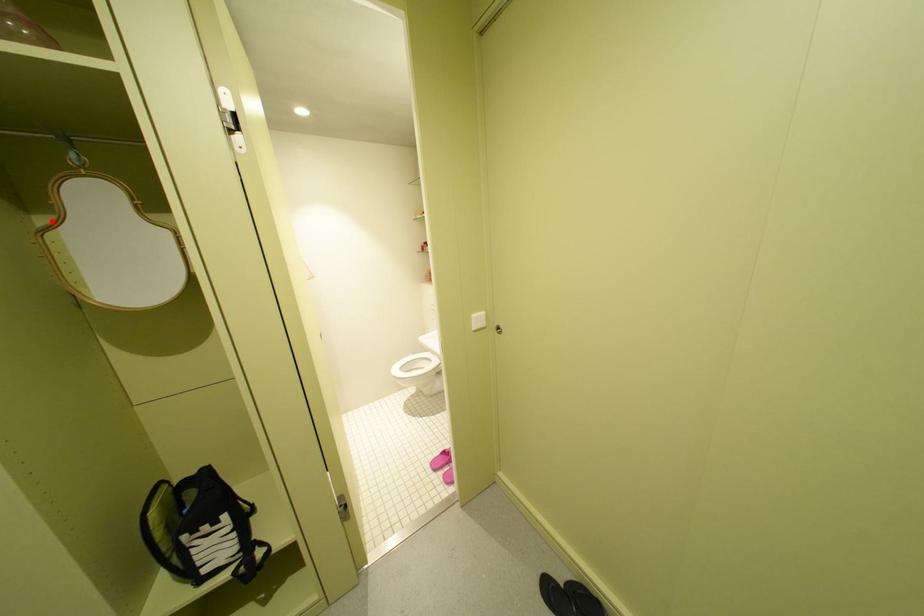
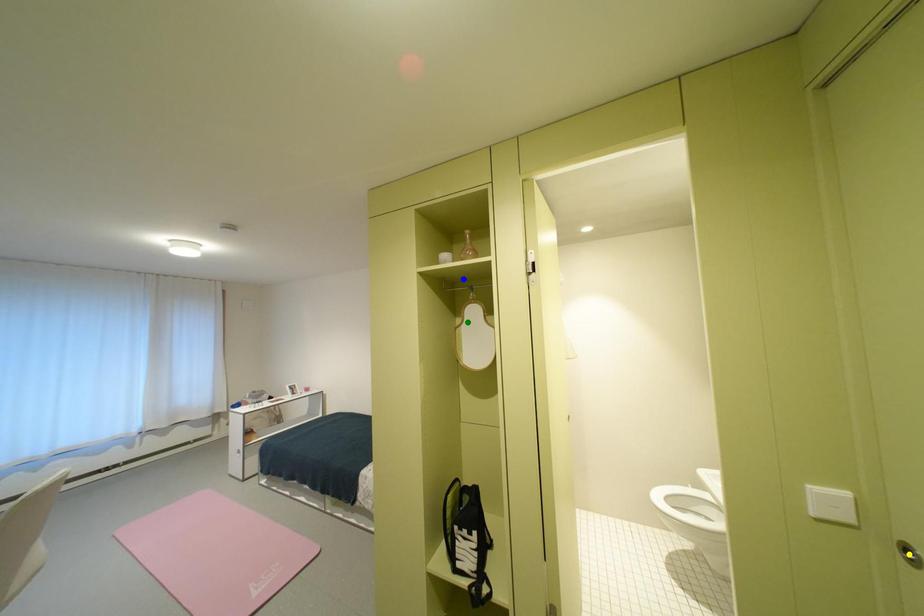
Question: I am providing you with two images of the same scene from different viewpoints. A red point is marked on the first image. You are given multiple points on the second image. Can you choose the point in image 2 that corresponds to the point in image 1?

Choices:
 (A) green point
 (B) yellow point
 (C) blue point

Answer: (A)